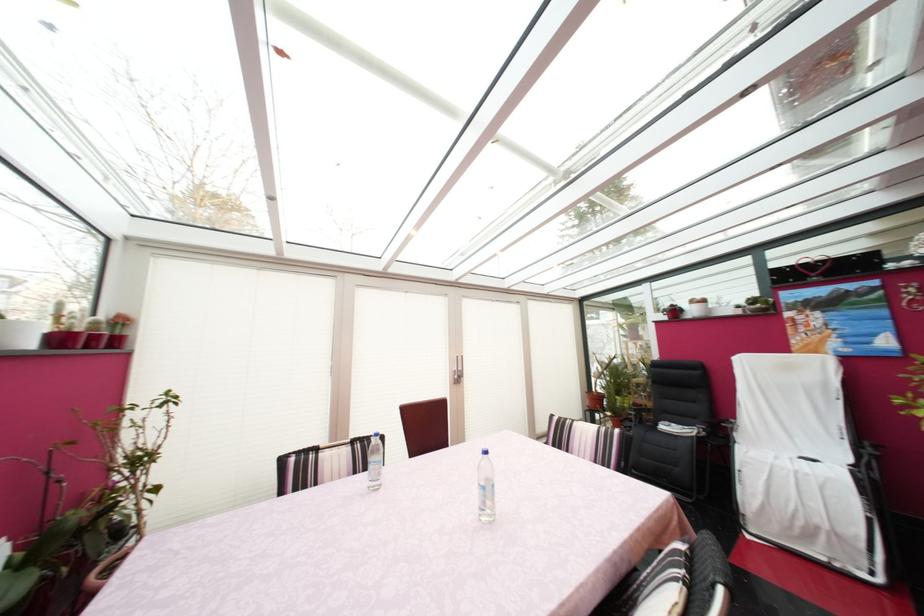
Where is `white plant pot`? white plant pot is located at coordinates (20, 334).